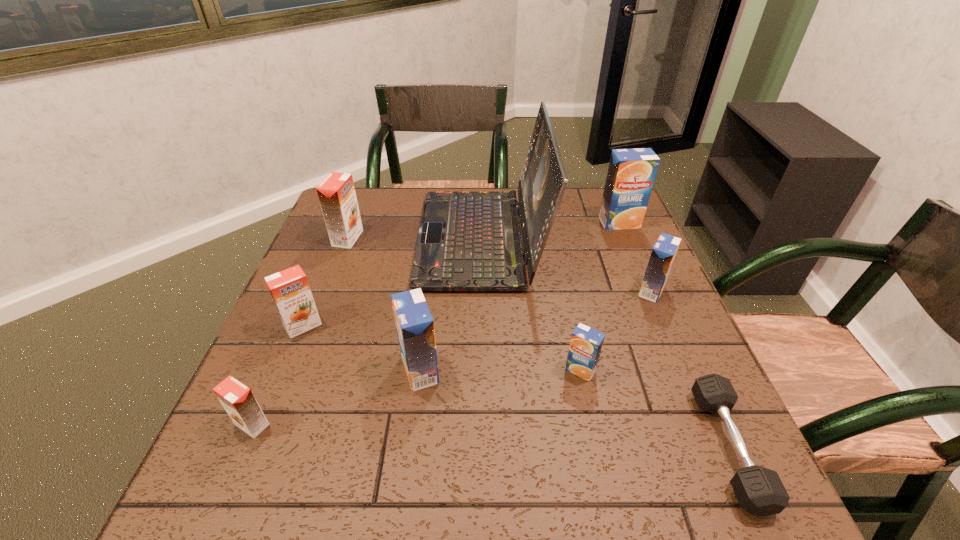
Find the location of `the tallest object`. the tallest object is located at coordinates (468, 241).

The width and height of the screenshot is (960, 540). What are the coordinates of `the biggest blue orange_juice` in the screenshot? It's located at (631, 173).

Identify the location of the tallest orange juice. (631, 173).

Image resolution: width=960 pixels, height=540 pixels. What are the coordinates of `the biggest orange orange juice` in the screenshot? It's located at (337, 196).

At what (x,y) coordinates should I click in order to perform the action: click on the fourth orange juice from left to right. Please return your answer as a coordinate pair (x, y). This screenshot has height=540, width=960. Looking at the image, I should click on (415, 326).

Find the location of `the leftmost blue orange_juice`. the leftmost blue orange_juice is located at coordinates (415, 326).

What are the coordinates of `the second farthest blue orange_juice` in the screenshot? It's located at (664, 251).

Where is `the fifth nearest orange juice`? The image size is (960, 540). the fifth nearest orange juice is located at coordinates (664, 251).

Identify the location of the second smallest orange orange juice. This screenshot has height=540, width=960. (290, 291).

This screenshot has height=540, width=960. Identify the location of the fourth farthest orange juice. (290, 291).